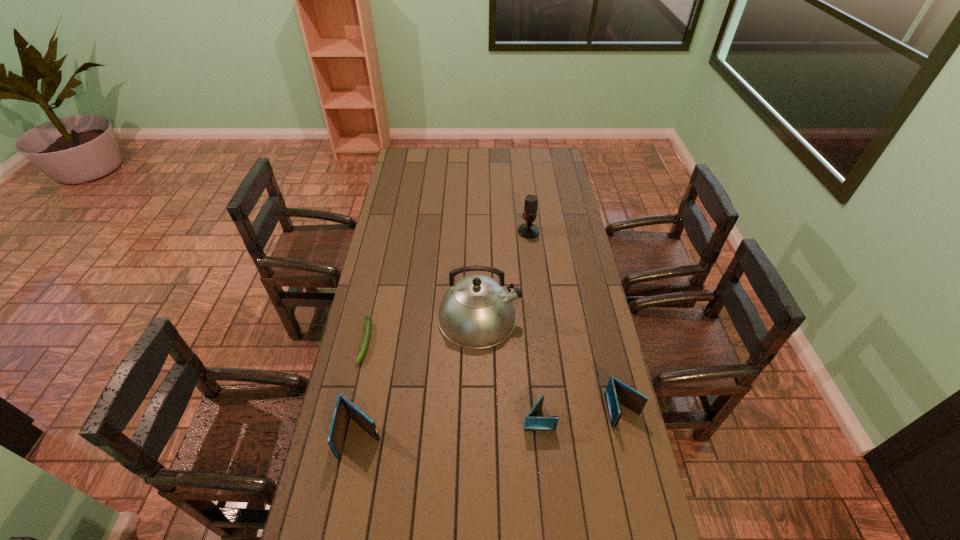
Where is `vacant space located 0.170m on the exterior surface of the leftmost wallet`? The width and height of the screenshot is (960, 540). vacant space located 0.170m on the exterior surface of the leftmost wallet is located at coordinates [x=345, y=524].

You are a GUI agent. You are given a task and a screenshot of the screen. Output one action in this format:
    pyautogui.click(x=<x>, y=<y>)
    Task: Click on the vacant area located 0.060m on the exterior surface of the second wallet from left to right
    
    Given the screenshot: What is the action you would take?
    pyautogui.click(x=573, y=418)

Find the location of a particular element. The width and height of the screenshot is (960, 540). vacant space located 0.250m on the exterior surface of the rightmost object is located at coordinates (650, 518).

The image size is (960, 540). Find the location of `free location located on the front-facing side of the zucchini`. free location located on the front-facing side of the zucchini is located at coordinates (349, 418).

Where is `vacant space situated on the side of the farthest object with the red ring`? The image size is (960, 540). vacant space situated on the side of the farthest object with the red ring is located at coordinates (505, 232).

Identify the location of vacant space located 0.380m on the side of the farthest object with the red ring. Image resolution: width=960 pixels, height=540 pixels. (435, 232).

The image size is (960, 540). Identify the location of free space located on the side of the farthest object with the red ring. (476, 232).

The width and height of the screenshot is (960, 540). Identify the location of vacant space located from the spout of the tallest object. (578, 317).

The image size is (960, 540). In order to click on wallet that is at the left edge in this screenshot , I will do `click(344, 407)`.

Where is `zucchini located at the left edge`? This screenshot has height=540, width=960. zucchini located at the left edge is located at coordinates (367, 325).